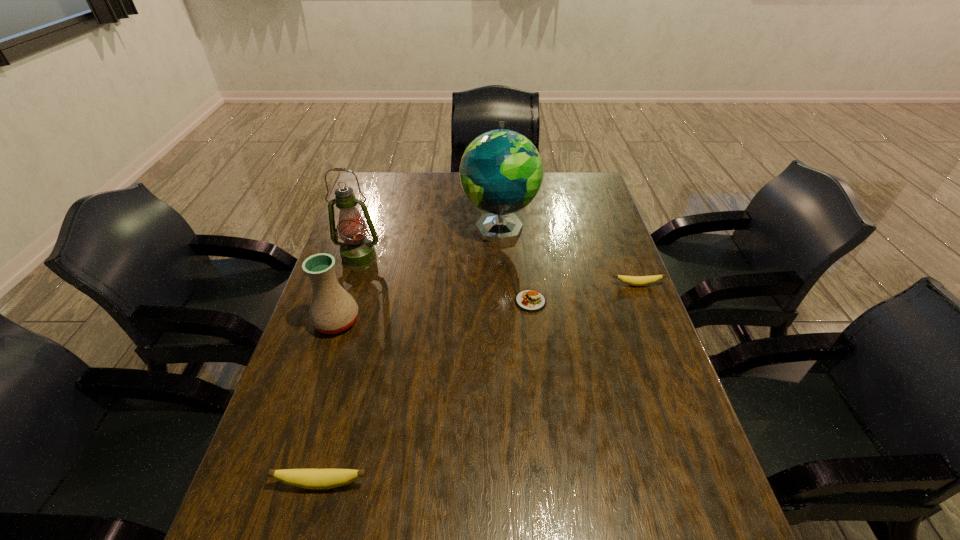
Please determine a free point for an extra banana to ensure balance. Please provide its 2D coordinates. Your answer should be formatted as a tuple, i.e. [(x, y)], where the tuple contains the x and y coordinates of a point satisfying the conditions above.

[(511, 364)]